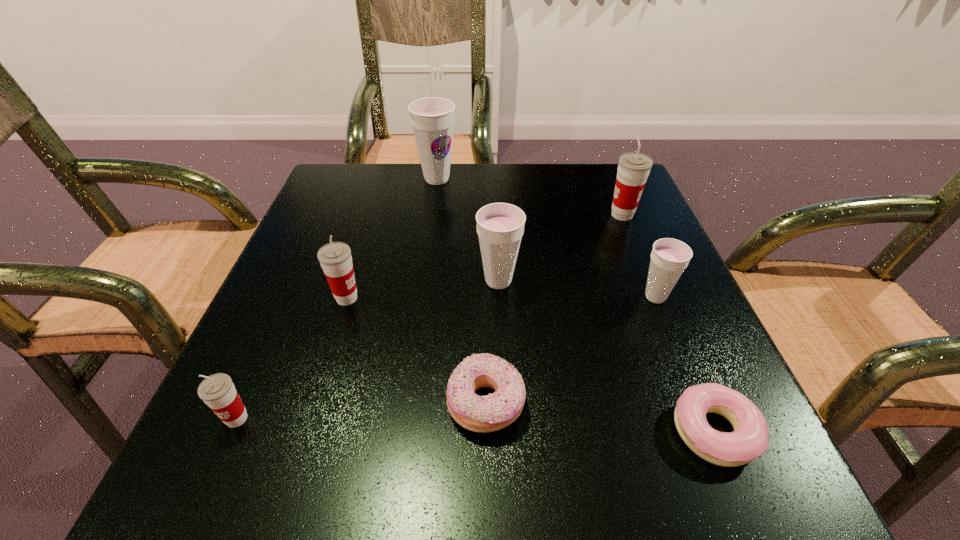
Find the location of a particular element. The image size is (960, 540). the biggest red cup is located at coordinates (x=633, y=169).

Find the location of a particular element. the rightmost red cup is located at coordinates (633, 169).

At what (x,y) coordinates should I click in order to perform the action: click on the sixth object from right to left. Please return your answer as a coordinate pair (x, y). The height and width of the screenshot is (540, 960). Looking at the image, I should click on (432, 118).

Where is `the leftmost purple cup`? Image resolution: width=960 pixels, height=540 pixels. the leftmost purple cup is located at coordinates (432, 118).

Find the location of `the seventh object from right to left`. the seventh object from right to left is located at coordinates (335, 258).

At what (x,y) coordinates should I click in order to perform the action: click on the fifth cup from right to left. Please return your answer as a coordinate pair (x, y). Looking at the image, I should click on (335, 258).

At what (x,y) coordinates should I click in order to perform the action: click on the second purple cup from right to left. Please return your answer as a coordinate pair (x, y). The height and width of the screenshot is (540, 960). Looking at the image, I should click on (500, 226).

Identify the location of the fourth cup from left to right. The image size is (960, 540). (500, 226).

I want to click on the rightmost purple cup, so click(x=669, y=257).

The height and width of the screenshot is (540, 960). Find the location of `the nearest cup`. the nearest cup is located at coordinates (217, 391).